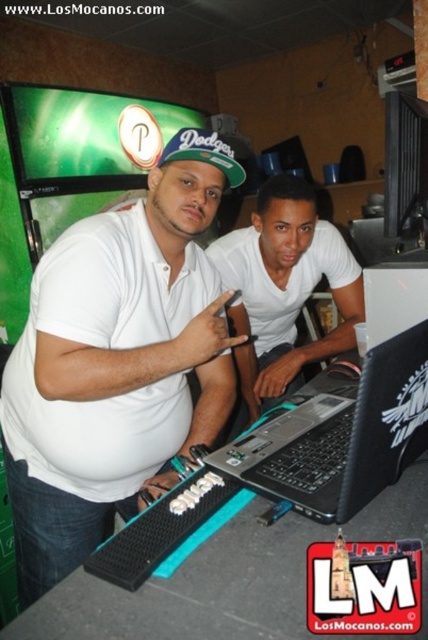
Which is below, white matte shirt at center or black plastic laptop at center?

black plastic laptop at center is below.

Can you confirm if white matte shirt at center is positioned below black plastic laptop at center?

Incorrect, white matte shirt at center is not positioned below black plastic laptop at center.

Locate an element on the screen. The image size is (428, 640). white matte shirt at center is located at coordinates (113, 371).

I want to click on white matte shirt at center, so click(x=113, y=371).

Is white matte shirt at center thinner than white matte laptop at center?

No, white matte shirt at center is not thinner than white matte laptop at center.

Is point (91, 520) positioned behind point (282, 289)?

No, it is not.

The height and width of the screenshot is (640, 428). In order to click on white matte shirt at center in this screenshot , I will do `click(113, 371)`.

In the scene shown: Does black plastic laptop at center appear on the right side of green fabric baseball cap at center?

Yes, black plastic laptop at center is to the right of green fabric baseball cap at center.

Is point (299, 428) in front of point (219, 148)?

Yes, it is in front of point (219, 148).

Which is behind, point (388, 376) or point (208, 148)?

The point (208, 148) is behind.

The image size is (428, 640). I want to click on black plastic laptop at center, so click(x=341, y=436).